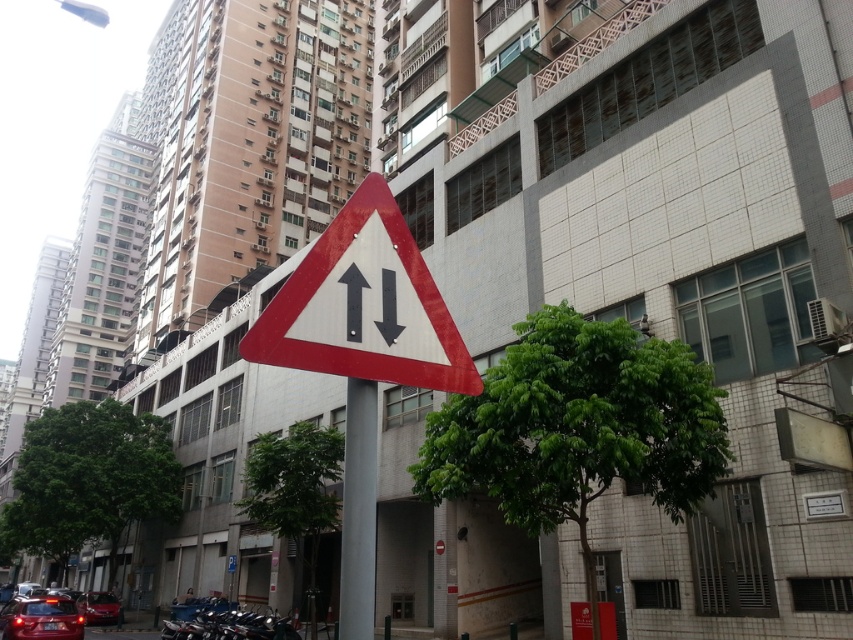
Question: Estimate the real-world distances between objects in this image. Which object is farther from the matte red car at lower left?

Choices:
 (A) reflective plastic triangle at center
 (B) black matte arrow at center

Answer: (B)

Question: Can you confirm if green leafy tree at center is wider than green leafy tree at lower left?

Choices:
 (A) no
 (B) yes

Answer: (A)

Question: Is green leafy tree at center further to the viewer compared to black matte arrow at center?

Choices:
 (A) no
 (B) yes

Answer: (B)

Question: Is green leafy tree at center positioned before green leafy tree at lower left?

Choices:
 (A) yes
 (B) no

Answer: (A)

Question: Estimate the real-world distances between objects in this image. Which object is farther from the green leafy tree at lower center?

Choices:
 (A) green leafy tree at lower left
 (B) metallic red car at lower left

Answer: (B)

Question: Which point appears farthest from the camera in this image?

Choices:
 (A) (297, 541)
 (B) (62, 600)
 (C) (396, 320)
 (D) (405, 294)

Answer: (A)